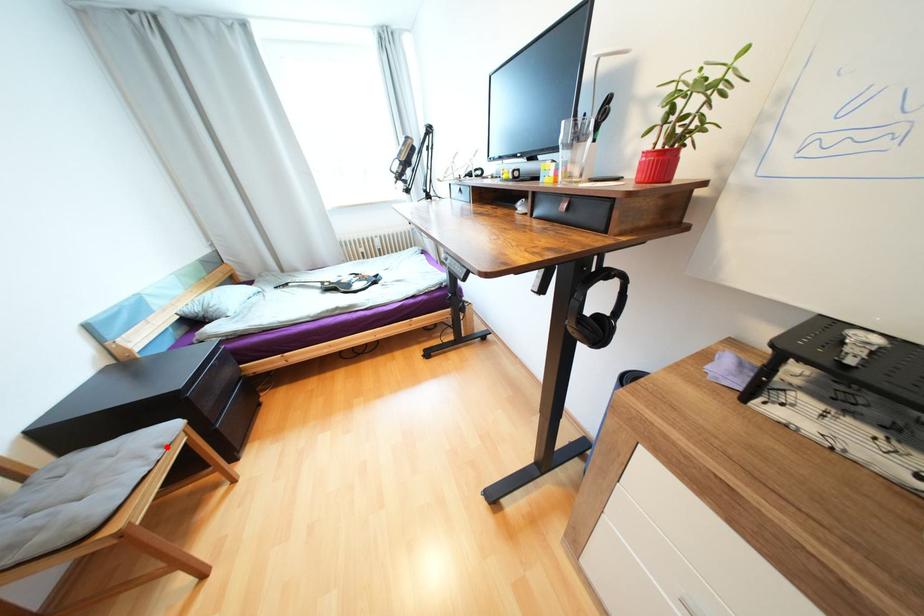
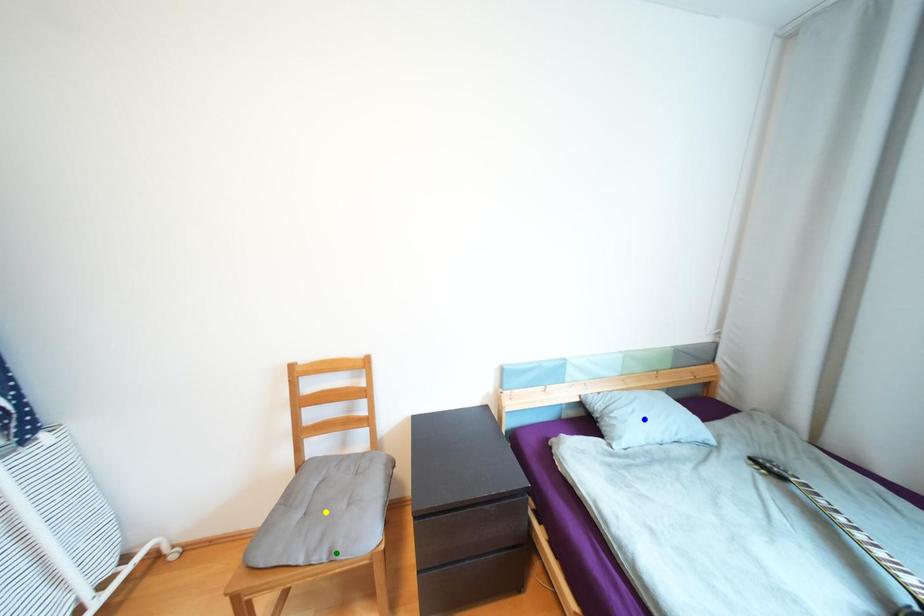
Question: I am providing you with two images of the same scene from different viewpoints. A red point is marked on the first image. You are given multiple points on the second image. Which spot in image 2 lines up with the point in image 1?

Choices:
 (A) green point
 (B) blue point
 (C) yellow point

Answer: (A)